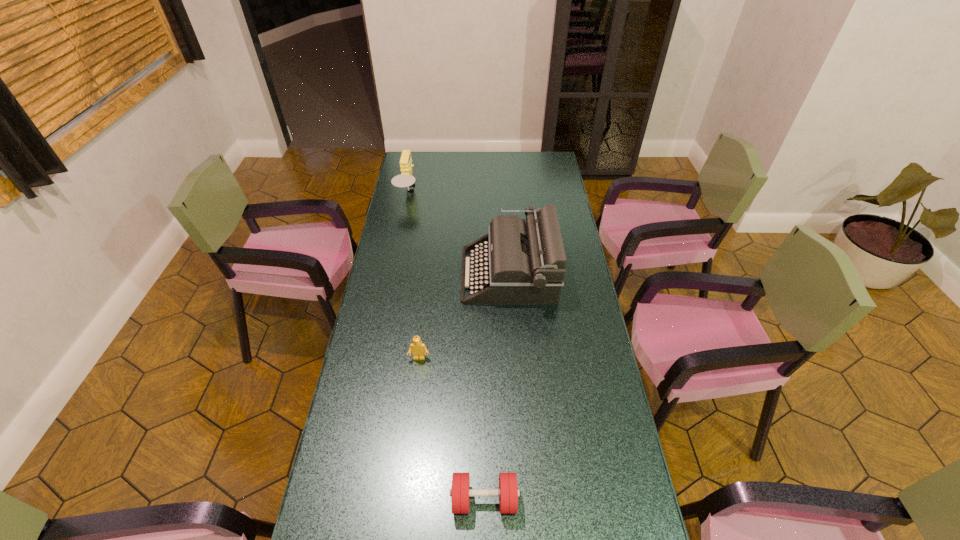
Identify the location of vacant area situated on the front-facing side of the farthest object. This screenshot has width=960, height=540. (444, 193).

Find the location of a particular element. The height and width of the screenshot is (540, 960). free space located 0.290m on the face of the second object from left to right is located at coordinates (409, 447).

Identify the location of free location located 0.070m on the back of the dumbbell. The image size is (960, 540). (484, 456).

At what (x,y) coordinates should I click in order to perform the action: click on object located at the left edge. Please return your answer as a coordinate pair (x, y). The image size is (960, 540). Looking at the image, I should click on (405, 179).

Identify the location of object present at the right edge. (526, 262).

Locate an element on the screen. vacant position at the far edge of the desktop is located at coordinates (468, 157).

Find the location of a particular element. This screenshot has height=540, width=960. vacant space at the left edge of the desktop is located at coordinates (429, 176).

You are a GUI agent. You are given a task and a screenshot of the screen. Output one action in this format:
    pyautogui.click(x=<x>, y=<y>)
    Task: Click on the free space at the right edge of the desktop
    This screenshot has height=540, width=960.
    Given the screenshot: What is the action you would take?
    pyautogui.click(x=608, y=437)

Where is `free spot between the leftmost object and the third nearest object`? Image resolution: width=960 pixels, height=540 pixels. free spot between the leftmost object and the third nearest object is located at coordinates pos(459,234).

Identify the location of vacant space that is in between the nearest object and the leftmost object. (446, 346).